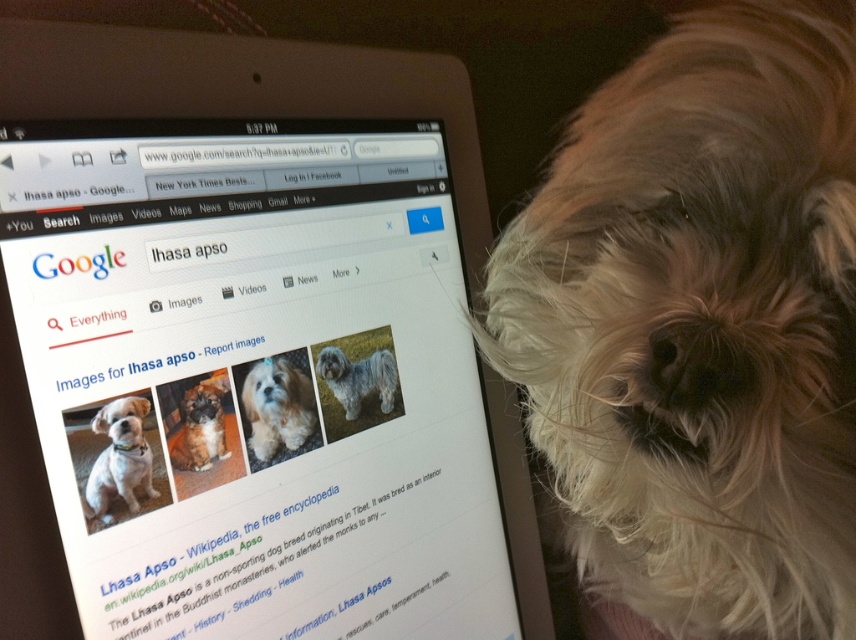
Where is the white fluffy dog at upper left located in the image?

The white fluffy dog at upper left is located at point [119,460].

Looking at this image, you are a photographer standing 16 inches away from the white fluffy dog at upper left. Can you take a clear photo of it without moving closer?

The white fluffy dog at upper left and viewer are 15.59 inches apart from each other, so you are close enough to take a clear photo without moving closer.